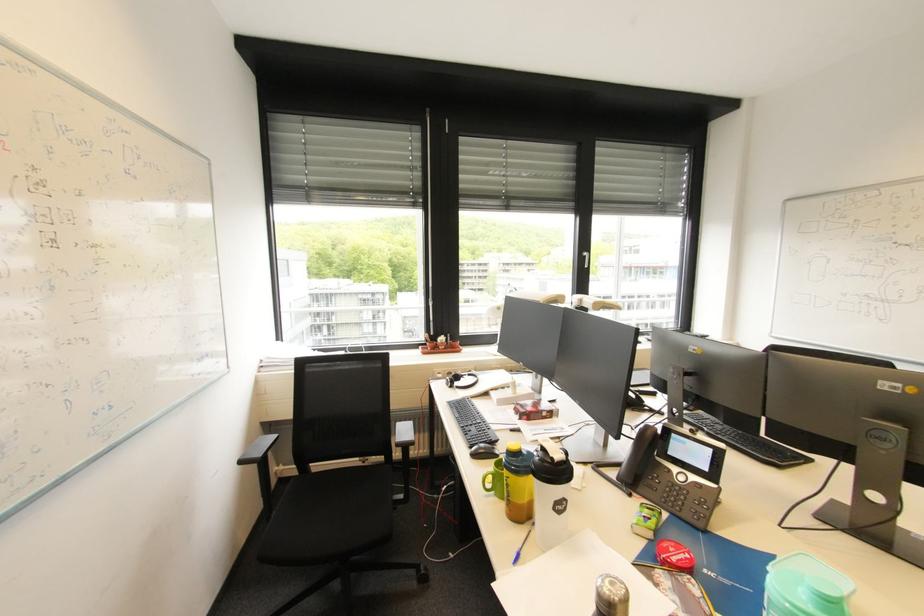
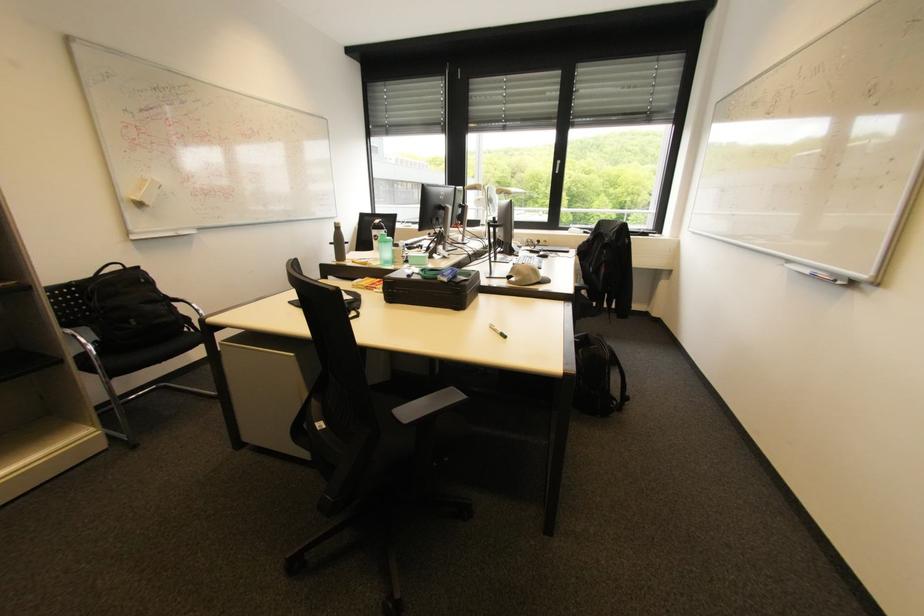
In the second image, find the point that corresponds to (247,463) in the first image.

(335, 244)